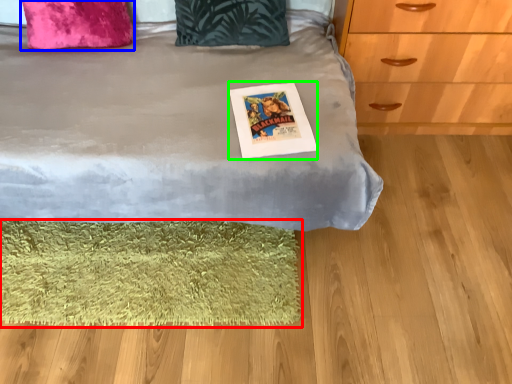
Question: Which is nearer to the mat (highlighted by a red box)? pillow (highlighted by a blue box) or postcard (highlighted by a green box).

Choices:
 (A) pillow
 (B) postcard

Answer: (B)